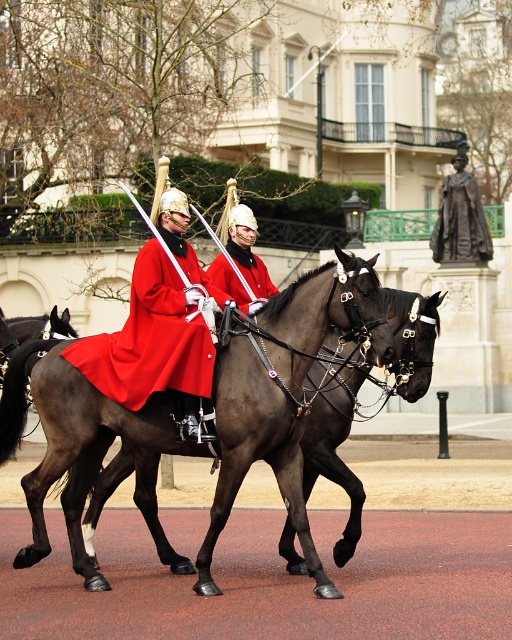
Between point (167, 438) and point (181, 308), which one is positioned in front?

Point (167, 438) is more forward.

Is shiny dark brown horse at center to the left of matte red coat at center from the viewer's perspective?

Incorrect, shiny dark brown horse at center is not on the left side of matte red coat at center.

Does point (151, 403) come farther from viewer compared to point (187, 369)?

Yes.

Locate an element on the screen. The image size is (512, 640). shiny dark brown horse at center is located at coordinates (284, 394).

Is shiny dark brown horse at center thinner than shiny red coat at center?

No.

Can you confirm if shiny dark brown horse at center is smaller than shiny red coat at center?

Incorrect, shiny dark brown horse at center is not smaller in size than shiny red coat at center.

Locate an element on the screen. This screenshot has width=512, height=640. shiny dark brown horse at center is located at coordinates (284, 394).

Who is shorter, matte red coat at center or shiny red coat at center?

matte red coat at center is shorter.

Between point (132, 342) and point (219, 256), which one is positioned behind?

The point (219, 256) is more distant.

The image size is (512, 640). I want to click on matte red coat at center, so (x=150, y=339).